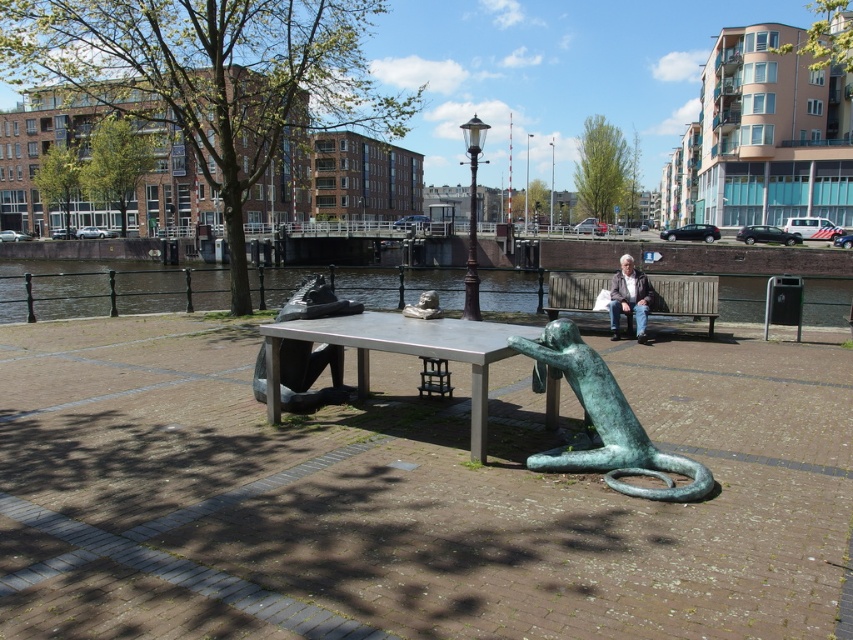
Which is in front, point (548, 454) or point (616, 296)?

Positioned in front is point (548, 454).

Is green patina bronze monkey at lower center below matte brown jacket at center?

Yes.

The image size is (853, 640). What do you see at coordinates (604, 420) in the screenshot?
I see `green patina bronze monkey at lower center` at bounding box center [604, 420].

The height and width of the screenshot is (640, 853). Find the location of `green patina bronze monkey at lower center`. green patina bronze monkey at lower center is located at coordinates (604, 420).

Describe the element at coordinates (85, 289) in the screenshot. This screenshot has height=640, width=853. I see `green patina water at center` at that location.

Is green patina water at center positioned in front of polished stone statue at center?

No, it is not.

Image resolution: width=853 pixels, height=640 pixels. I want to click on green patina water at center, so click(x=85, y=289).

Who is lower down, green patina water at center or wooden bench at center?

Positioned lower is wooden bench at center.

Who is more forward, (42, 307) or (659, 282)?

Point (659, 282)

This screenshot has width=853, height=640. What do you see at coordinates (85, 289) in the screenshot?
I see `green patina water at center` at bounding box center [85, 289].

Find the location of a particular element. The height and width of the screenshot is (640, 853). green patina water at center is located at coordinates (85, 289).